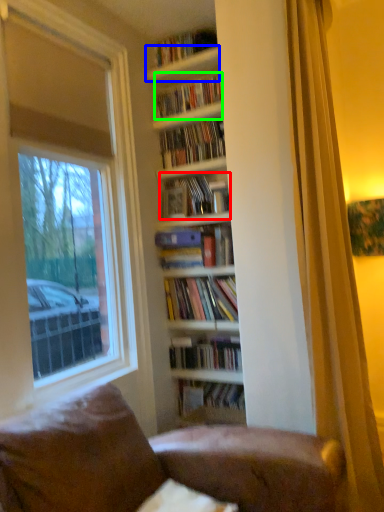
Question: Which object is positioned closest to book (highlighted by a red box)? Select from shelf (highlighted by a blue box) and book (highlighted by a green box).

Choices:
 (A) shelf
 (B) book

Answer: (B)